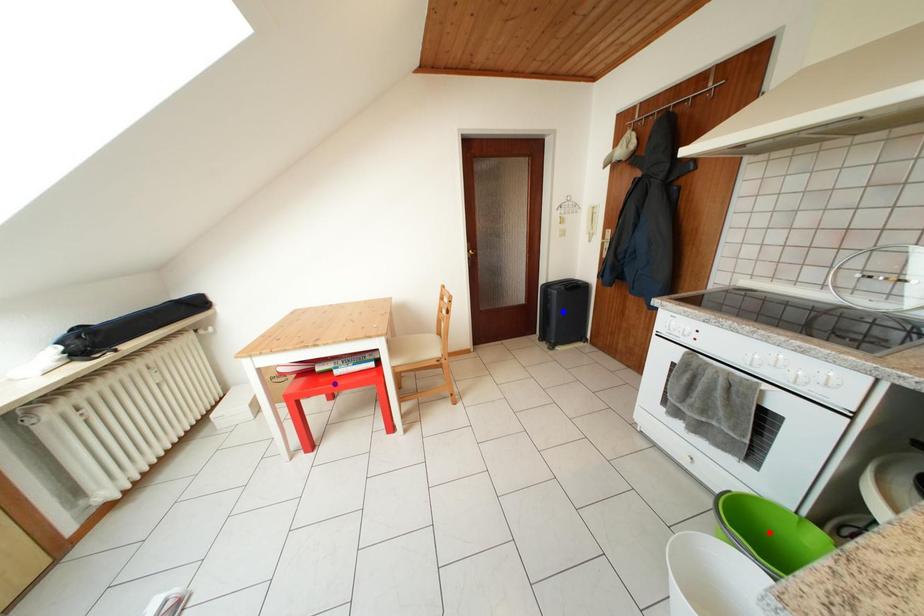
Order these from nearest to farthest:
blue point, red point, purple point

red point < purple point < blue point